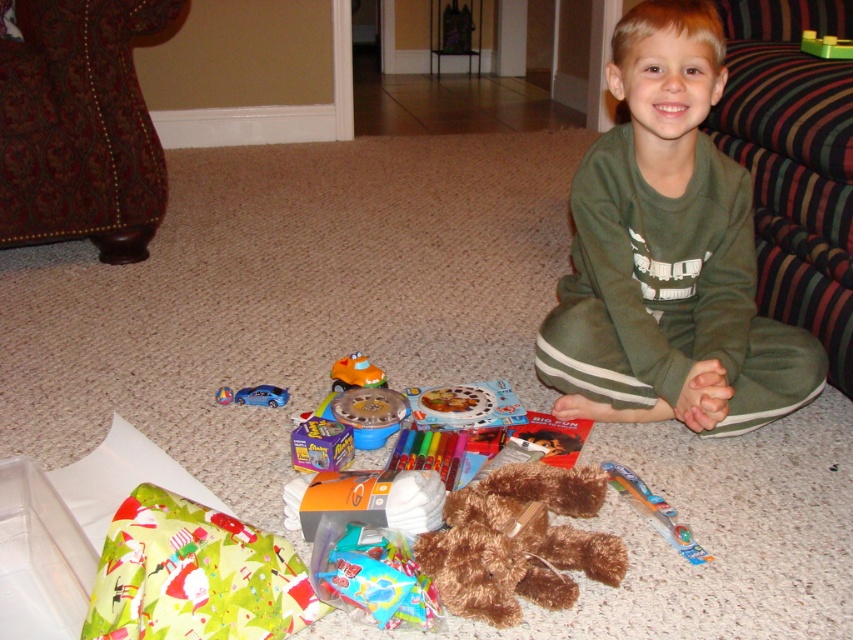
Question: Is translucent plastic candy at center closer to the viewer compared to shiny plastic toy car at center?

Choices:
 (A) yes
 (B) no

Answer: (A)

Question: Estimate the real-world distances between objects in this image. Which object is farther from the shiny plastic toy car at center?

Choices:
 (A) shiny purple toy car at center
 (B) orange plastic toy car at center

Answer: (B)

Question: Which of the following is the farthest from the observer?

Choices:
 (A) green cotton sweatshirt at center
 (B) green plastic toy at center
 (C) brown fabric armchair at left

Answer: (C)

Question: Estimate the real-world distances between objects in this image. Which object is farther from the striped fabric armchair at right?

Choices:
 (A) shiny purple toy car at center
 (B) brown fabric armchair at left

Answer: (B)

Question: Does shiny plastic toy car at center have a lesser width compared to orange plastic toy car at center?

Choices:
 (A) yes
 (B) no

Answer: (B)

Question: Does shiny plastic toy car at center come in front of orange plastic toy car at center?

Choices:
 (A) yes
 (B) no

Answer: (A)